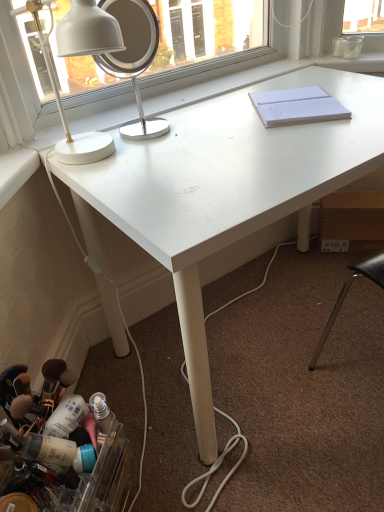
Locate an element on the screen. free space above white matte desk at center (from a real-world perspective) is located at coordinates (251, 131).